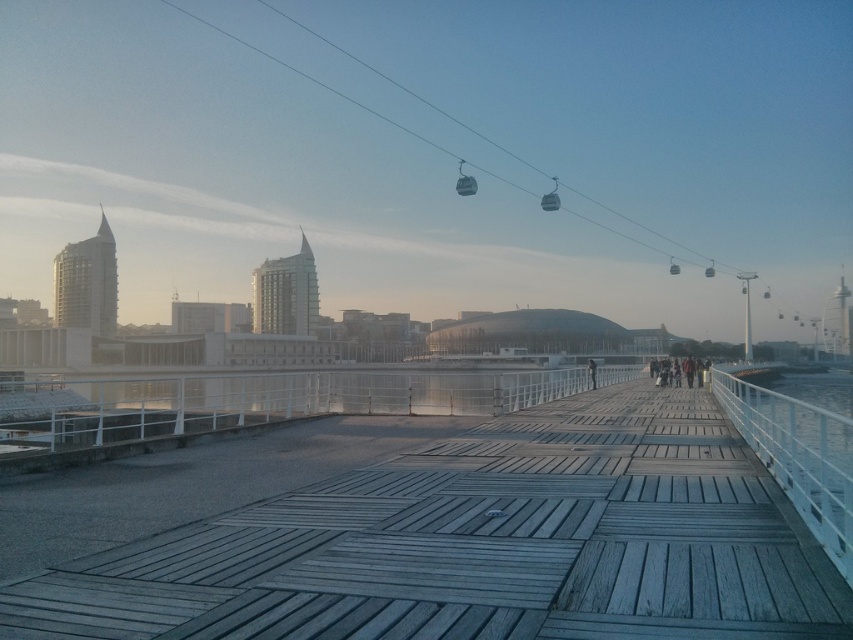
You are standing on the wooden boardwalk and looking at two points in the scene. One is labeled as point (798, 576) and the other as point (595, 364). Which point is closer to your current position on the boardwalk?

Point (798, 576) is closer to the camera than point (595, 364), so the point labeled (798, 576) is closer to your current position on the boardwalk.

In the scene shown: Based on the provided scene description, where is the wooden at center located in terms of its 2D coordinates?

The wooden at center is located at the 2D coordinates point (480,545).